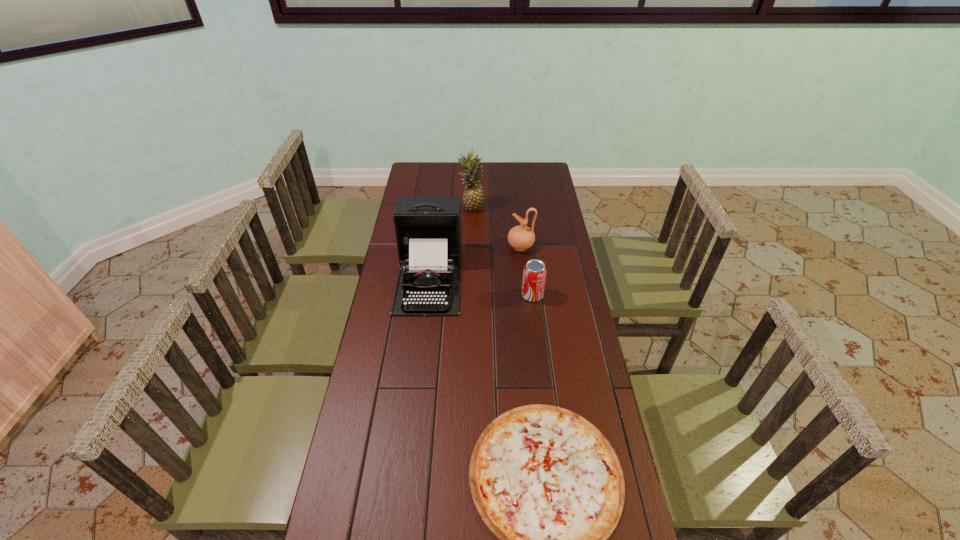
The width and height of the screenshot is (960, 540). I want to click on free space between the fourth tallest object and the farthest object, so point(502,252).

At what (x,y) coordinates should I click in order to perform the action: click on the closest object to the third tallest object. Please return your answer as a coordinate pair (x, y). Looking at the image, I should click on (428, 229).

The image size is (960, 540). Find the location of `the third closest object relative to the second shortest object`. the third closest object relative to the second shortest object is located at coordinates (546, 482).